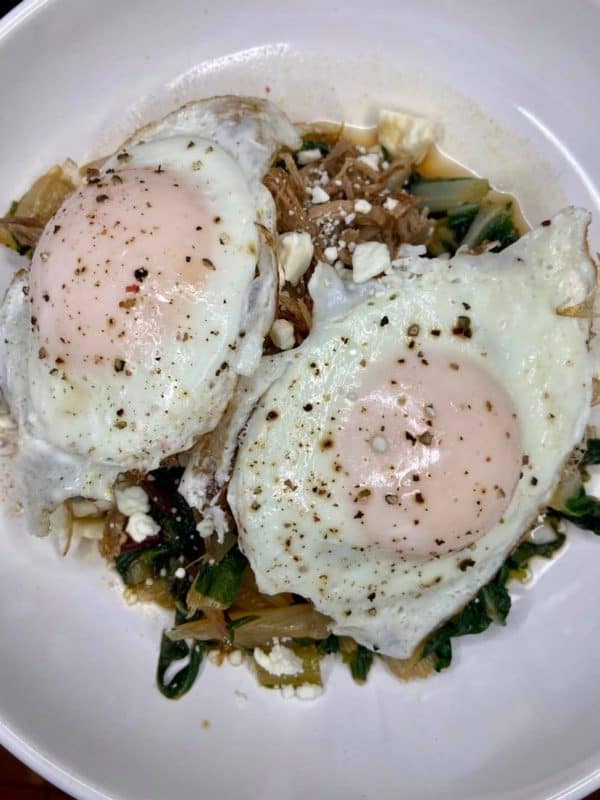
Find the location of a particular element. table is located at coordinates (19, 796).